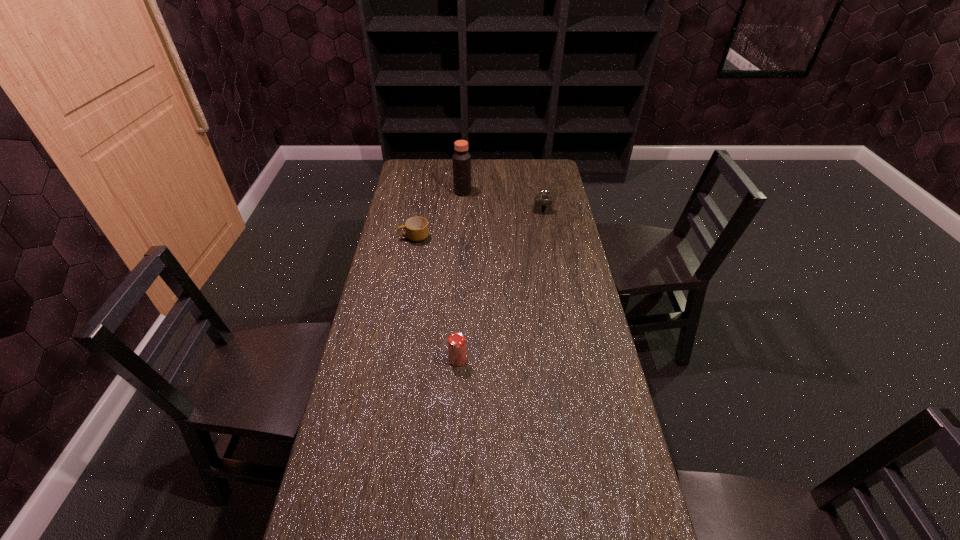
Where is `vinegar`? This screenshot has width=960, height=540. vinegar is located at coordinates (461, 160).

This screenshot has width=960, height=540. I want to click on the tallest object, so (x=461, y=160).

The image size is (960, 540). I want to click on the second farthest object, so click(x=542, y=203).

Locate an element on the screen. padlock is located at coordinates pyautogui.click(x=542, y=203).

Find the location of a particular element. beer can is located at coordinates (456, 342).

At what (x,y) coordinates should I click in order to perform the action: click on the third farthest object. Please return your answer as a coordinate pair (x, y). The height and width of the screenshot is (540, 960). Looking at the image, I should click on (417, 229).

Locate an element on the screen. The width and height of the screenshot is (960, 540). mug is located at coordinates (417, 229).

The image size is (960, 540). I want to click on blank space located on the right of the tallest object, so click(487, 192).

You are a GUI agent. You are given a task and a screenshot of the screen. Output one action in this format:
    pyautogui.click(x=<x>, y=<y>)
    Task: Click on the vacant space located 0.160m at the front of the rightmost object near the keyhole
    The height and width of the screenshot is (540, 960).
    Given the screenshot: What is the action you would take?
    pyautogui.click(x=547, y=238)

This screenshot has width=960, height=540. In order to click on free space located on the left of the nearest object in this screenshot , I will do `click(405, 360)`.